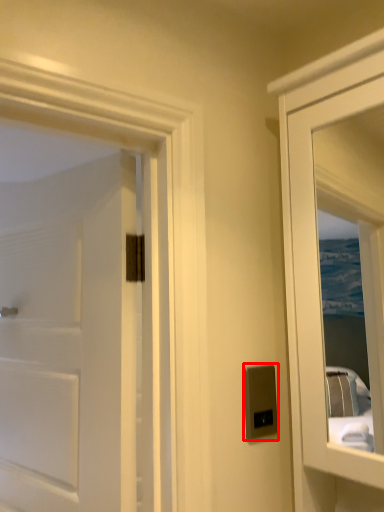
Question: Where is electric outlet (annotated by the red box) located in relation to door in the image?

Choices:
 (A) left
 (B) right

Answer: (B)